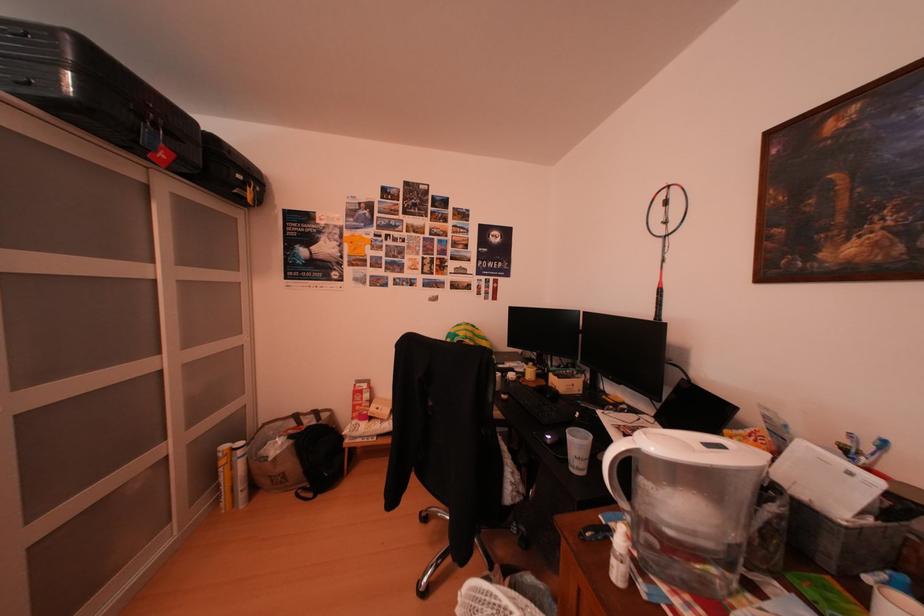
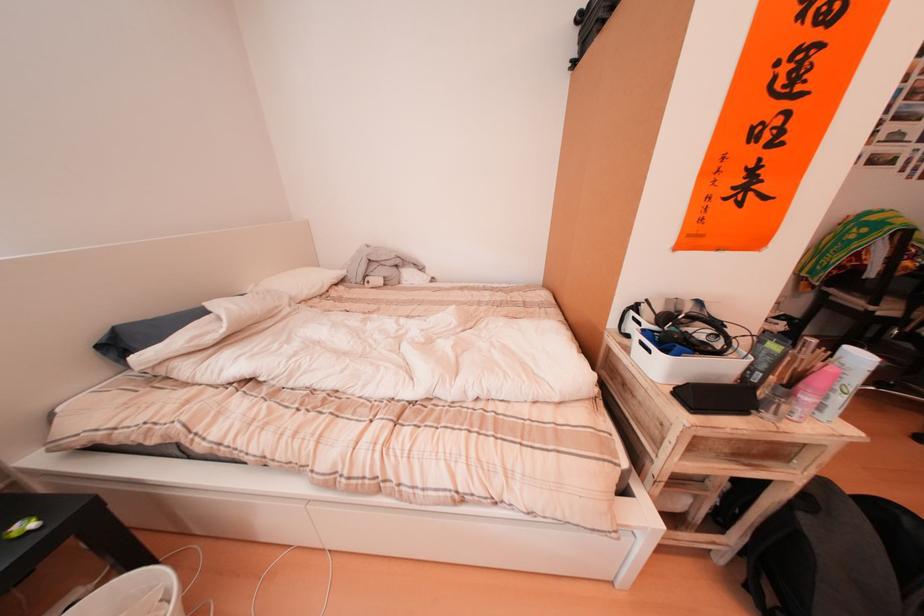
Question: In a continuous first-person perspective shot, in which direction is the camera moving?

Choices:
 (A) Left
 (B) Right
 (C) Forward
 (D) Backward

Answer: (A)